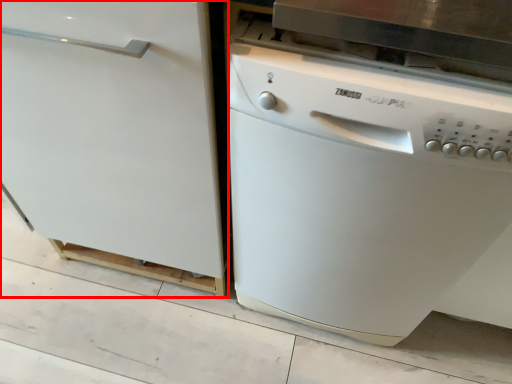
Question: Considering the relative positions of home appliance (annotated by the red box) and dish washer in the image provided, where is home appliance (annotated by the red box) located with respect to the staircase?

Choices:
 (A) left
 (B) right

Answer: (A)